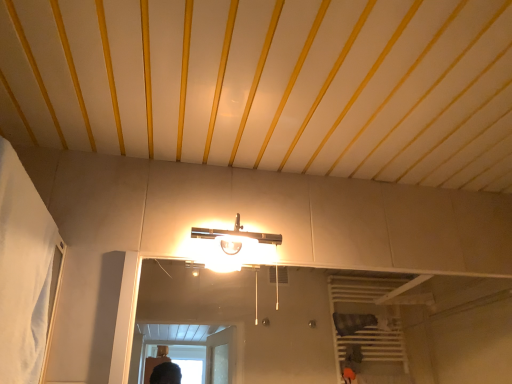
Question: Is white fabric curtain at left at the left side of satin nickel fixture at center?

Choices:
 (A) yes
 (B) no

Answer: (A)

Question: Does white fabric curtain at left have a lesser width compared to satin nickel fixture at center?

Choices:
 (A) yes
 (B) no

Answer: (A)

Question: Is white fabric curtain at left surrounding satin nickel fixture at center?

Choices:
 (A) no
 (B) yes

Answer: (A)

Question: Is white fabric curtain at left smaller than satin nickel fixture at center?

Choices:
 (A) no
 (B) yes

Answer: (A)

Question: Is white fabric curtain at left at the right side of satin nickel fixture at center?

Choices:
 (A) no
 (B) yes

Answer: (A)

Question: From a real-world perspective, is white fabric curtain at left positioned over satin nickel fixture at center based on gravity?

Choices:
 (A) no
 (B) yes

Answer: (A)

Question: Does satin nickel fixture at center have a lesser width compared to white fabric curtain at left?

Choices:
 (A) no
 (B) yes

Answer: (A)

Question: From the image's perspective, is satin nickel fixture at center above white fabric curtain at left?

Choices:
 (A) no
 (B) yes

Answer: (A)

Question: Is satin nickel fixture at center directly adjacent to white fabric curtain at left?

Choices:
 (A) yes
 (B) no

Answer: (B)

Question: Is satin nickel fixture at center positioned in front of white fabric curtain at left?

Choices:
 (A) no
 (B) yes

Answer: (A)

Question: Does satin nickel fixture at center have a lesser height compared to white fabric curtain at left?

Choices:
 (A) no
 (B) yes

Answer: (B)

Question: Can you confirm if satin nickel fixture at center is taller than white fabric curtain at left?

Choices:
 (A) no
 (B) yes

Answer: (A)

Question: Is satin nickel fixture at center taller or shorter than white fabric curtain at left?

Choices:
 (A) tall
 (B) short

Answer: (B)